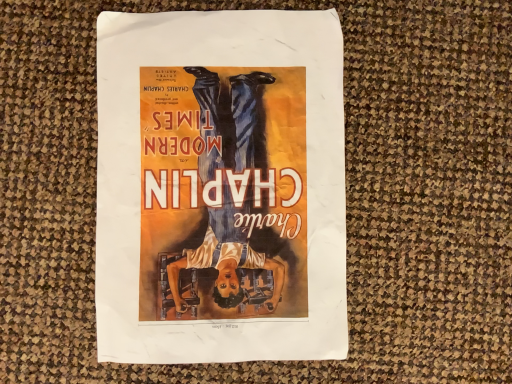
Locate an element on the screen. Image resolution: width=512 pixels, height=384 pixels. free spot above matte paper poster at center (from a real-world perspective) is located at coordinates (216, 195).